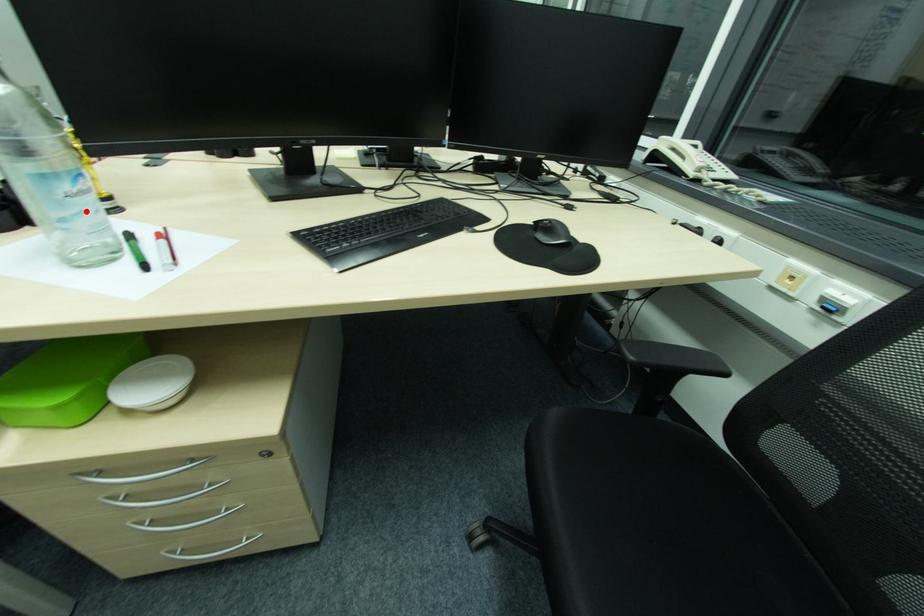
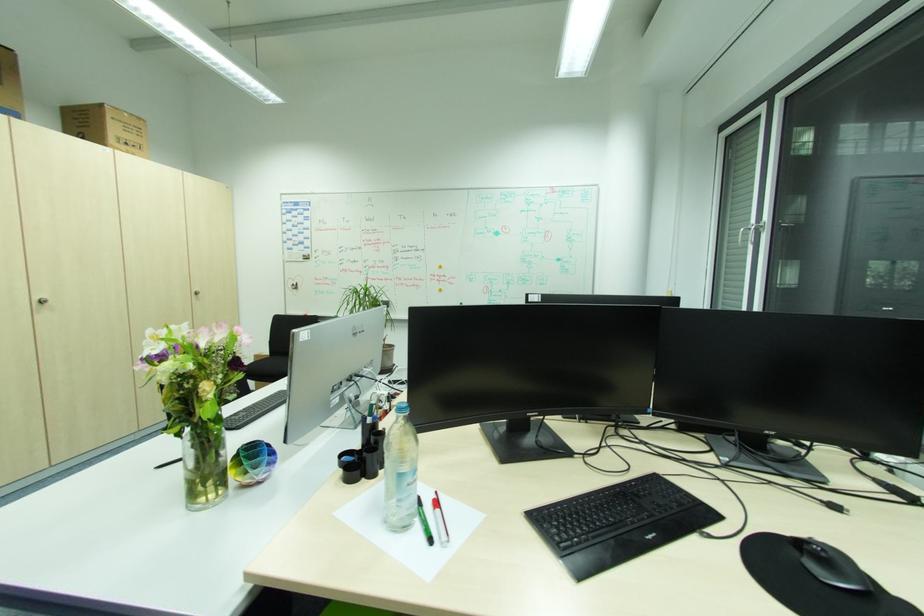
Question: A red point is marked in image1. In image2, is the corresponding 3D point closer to the camera or farther? Reply with the corresponding letter.

Choices:
 (A) The corresponding 3D point is closer.
 (B) The corresponding 3D point is farther.

Answer: (B)